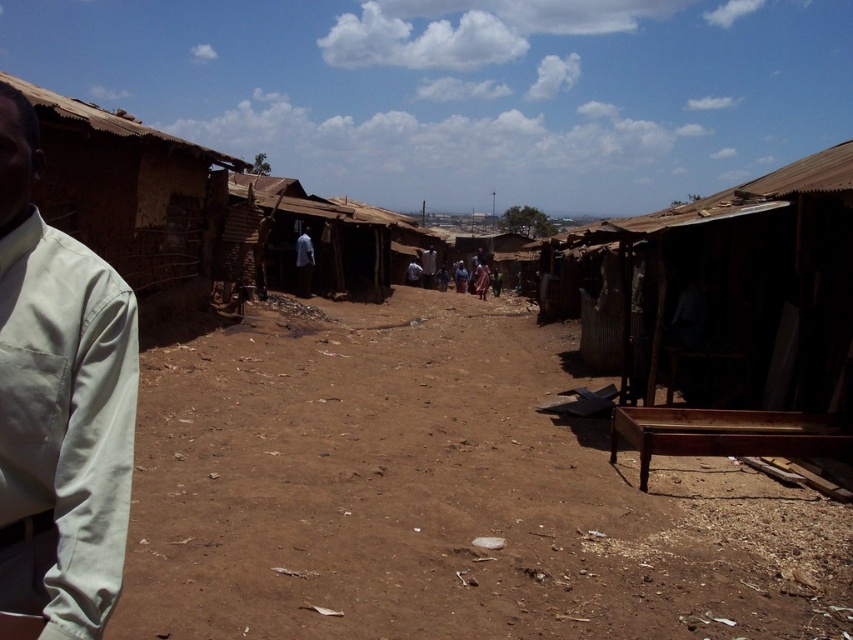
Question: Which object appears closest to the camera in this image?

Choices:
 (A) brown dirt field at center
 (B) brown mud hut at left
 (C) white matte shirt at center
 (D) light gray fabric shirt at left

Answer: (D)

Question: Is light gray fabric shirt at left closer to the viewer compared to white matte shirt at center?

Choices:
 (A) yes
 (B) no

Answer: (A)

Question: Which of the following is the closest to the observer?

Choices:
 (A) brown mud hut at left
 (B) white matte shirt at center
 (C) light brown wooden chair at center
 (D) light gray fabric shirt at left

Answer: (D)

Question: Is brown dirt field at center thinner than brown mud hut at left?

Choices:
 (A) yes
 (B) no

Answer: (B)

Question: Considering the real-world distances, which object is closest to the white matte shirt at center?

Choices:
 (A) light gray fabric shirt at left
 (B) brown mud hut at left

Answer: (B)

Question: Does light gray fabric shirt at left have a lesser width compared to light brown wooden chair at center?

Choices:
 (A) yes
 (B) no

Answer: (A)